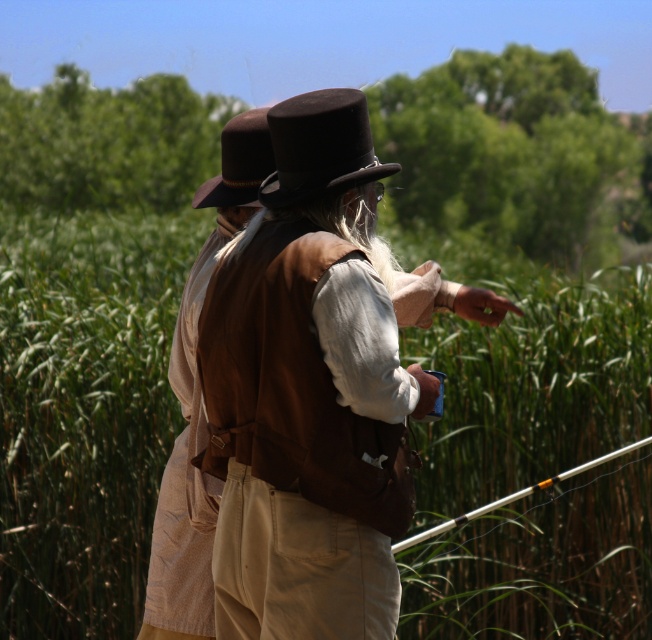
You are standing at the origin point in the image and want to walk to the point marked as point (x=259, y=145). However, there is an obstacle at point (x=338, y=90). Will you encounter this obstacle before reaching your destination?

Yes, you will encounter the obstacle at point (x=338, y=90) before reaching point (x=259, y=145) because point (x=338, y=90) is in front of point (x=259, y=145).

You are standing in the scene and want to reach the point at coordinates point (291, 106). If you can walk 10 feet per minute, how long will it take you to reach that point?

The distance of point (291, 106) from viewer is 13.34 feet. At a walking speed of 10 feet per minute, it would take approximately 1.33 minutes to reach the point.

You are an observer standing in front of the scene. You notice the green grass at center and the brown felt hat at upper center. Which object is closer to you?

The green grass at center is closer to you because the brown felt hat at upper center is behind it.